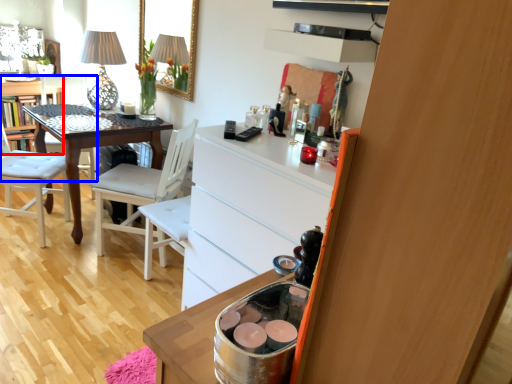
Question: Which point is closer to the camera, vanity (highlighted by a red box) or chair (highlighted by a blue box)?

Choices:
 (A) vanity
 (B) chair

Answer: (B)